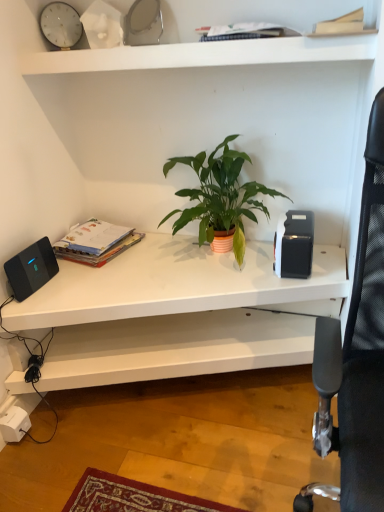
Question: Are black plastic toaster at right and white matte shelf at upper center, positioned as the first shelf in top-to-bottom order, beside each other?

Choices:
 (A) yes
 (B) no

Answer: (B)

Question: Could you tell me if black plastic toaster at right is facing white matte shelf at upper center, positioned as the first shelf in top-to-bottom order?

Choices:
 (A) yes
 (B) no

Answer: (B)

Question: Is black plastic toaster at right thinner than white matte shelf at upper center, the second shelf from the bottom?

Choices:
 (A) yes
 (B) no

Answer: (A)

Question: Considering the relative sizes of black plastic toaster at right and white matte shelf at upper center, positioned as the first shelf in top-to-bottom order, in the image provided, is black plastic toaster at right shorter than white matte shelf at upper center, positioned as the first shelf in top-to-bottom order,?

Choices:
 (A) no
 (B) yes

Answer: (A)

Question: From a real-world perspective, is black plastic toaster at right below white matte shelf at upper center, the second shelf from the bottom?

Choices:
 (A) no
 (B) yes

Answer: (B)

Question: Considering their positions, is black matte speaker at left located in front of or behind black mesh computer chair at right?

Choices:
 (A) front
 (B) behind

Answer: (B)

Question: Considering the positions of point (13, 274) and point (354, 468), is point (13, 274) closer or farther from the camera than point (354, 468)?

Choices:
 (A) closer
 (B) farther

Answer: (B)

Question: Based on their positions, is black matte speaker at left located to the left or right of black mesh computer chair at right?

Choices:
 (A) right
 (B) left

Answer: (B)

Question: In terms of height, does black matte speaker at left look taller or shorter compared to black mesh computer chair at right?

Choices:
 (A) short
 (B) tall

Answer: (A)

Question: From a real-world perspective, is white glossy clock at upper left positioned above or below matte paperbacks at left, which is the 1th paperback book from left to right?

Choices:
 (A) above
 (B) below

Answer: (A)

Question: Is white glossy clock at upper left situated inside matte paperbacks at left, arranged as the second paperback book when viewed from the front, or outside?

Choices:
 (A) outside
 (B) inside

Answer: (A)

Question: Does point (39, 17) appear closer or farther from the camera than point (114, 237)?

Choices:
 (A) farther
 (B) closer

Answer: (B)

Question: In terms of width, does white glossy clock at upper left look wider or thinner when compared to matte paperbacks at left, arranged as the first paperback book when ordered from the bottom?

Choices:
 (A) thin
 (B) wide

Answer: (A)

Question: Based on their sizes in the image, would you say light brown paper at upper right, the first paperback book from the top, is bigger or smaller than green matte plant at center?

Choices:
 (A) small
 (B) big

Answer: (A)

Question: Based on their positions, is light brown paper at upper right, the first paperback book from the top, located to the left or right of green matte plant at center?

Choices:
 (A) right
 (B) left

Answer: (A)